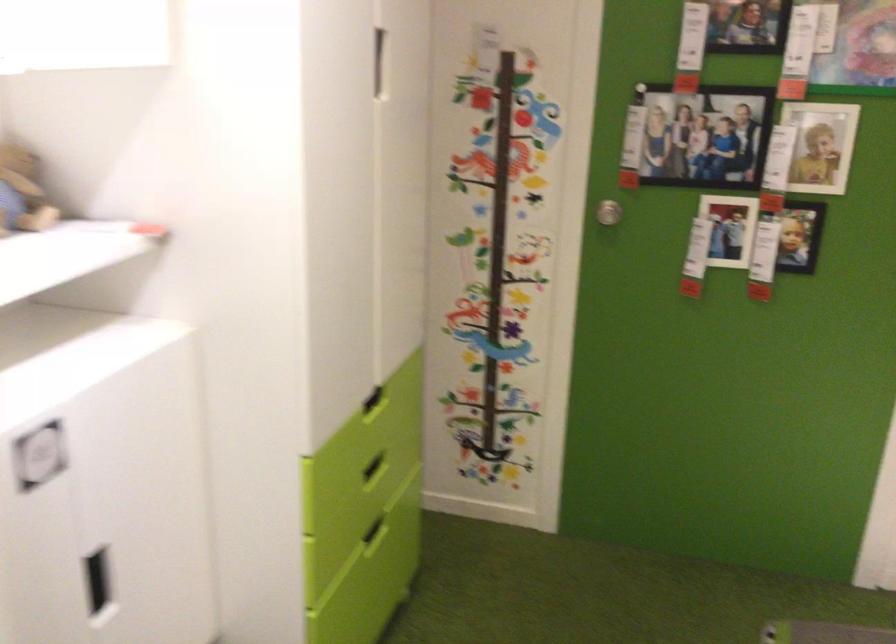
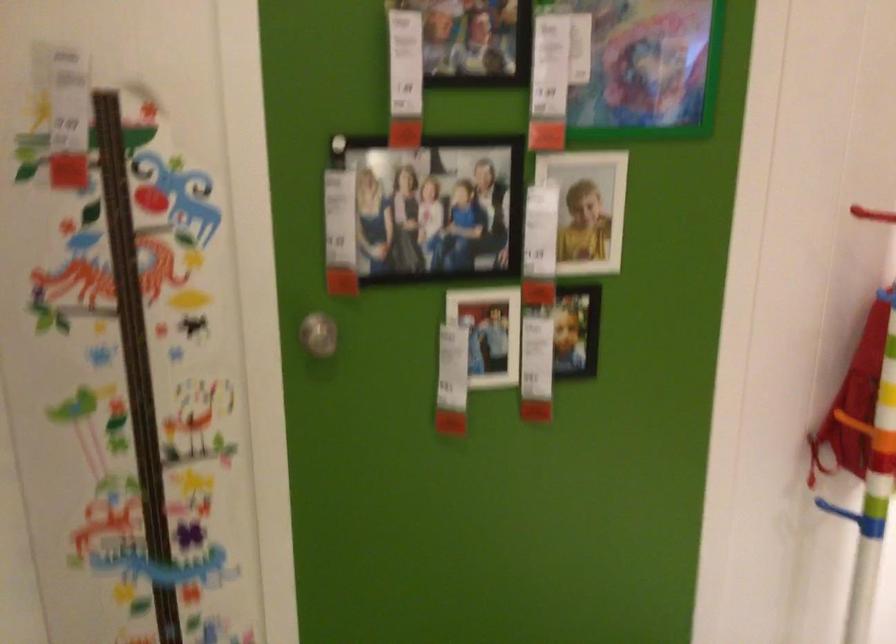
Question: The first image is from the beginning of the video and the second image is from the end. How did the camera likely rotate when shooting the video?

Choices:
 (A) Left
 (B) Right
 (C) Up
 (D) Down

Answer: (B)